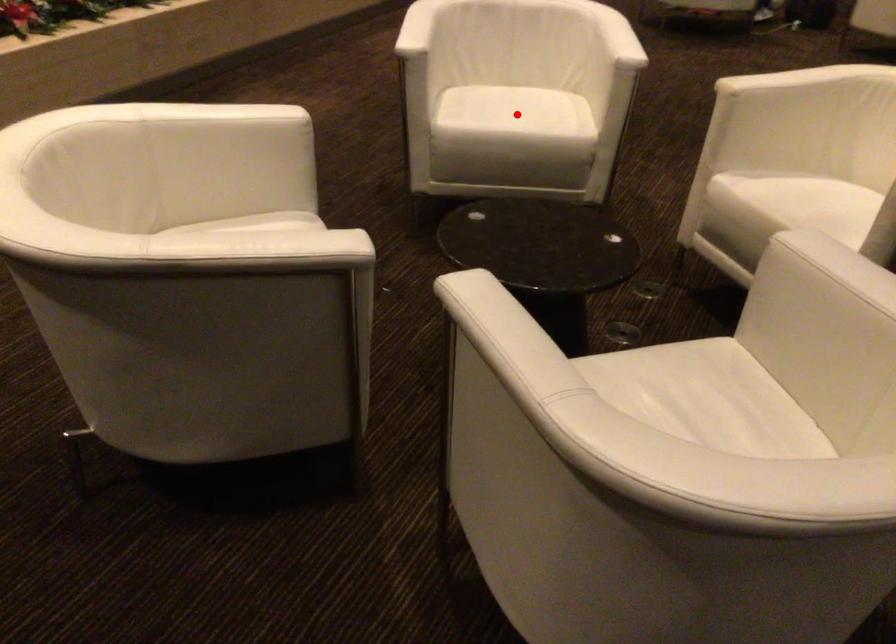
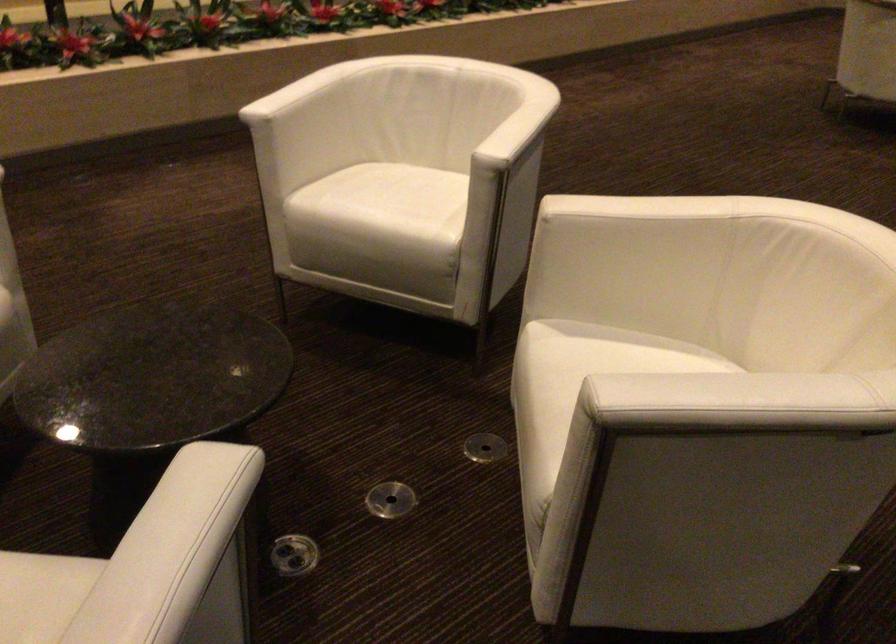
Find the pixel in the second image that matches the highlighted location in the first image.

(383, 205)